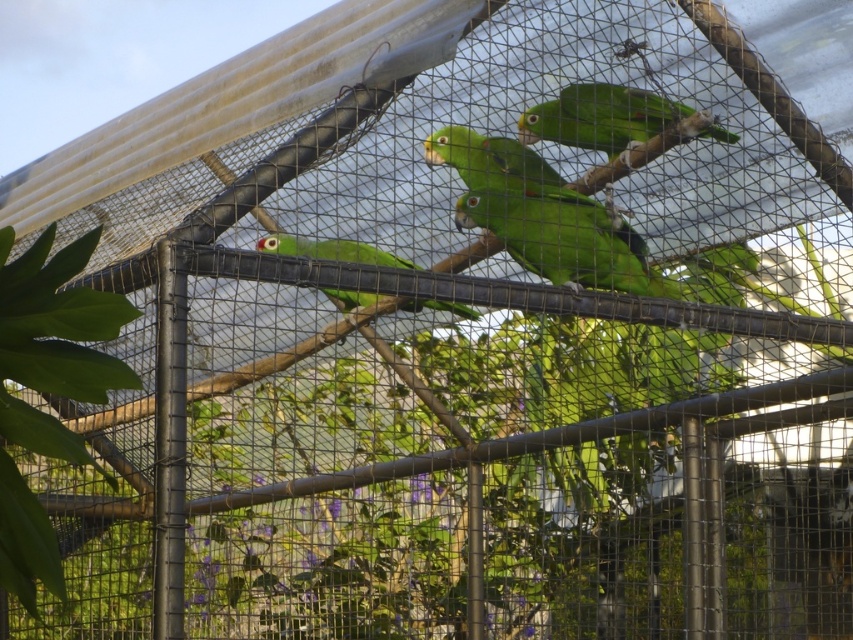
You are a bird keeper who needs to place a 12 inch long feeding tray between the green matte parrot at upper center and the green matte parrot at center. Can the feeding tray fit between them?

The green matte parrot at upper center and green matte parrot at center are 14.44 inches apart from each other. Since the feeding tray is 12 inches long, it can fit between them with some space remaining.

You are a birdwatcher observing the green matte parrot at upper center and the green matte parrot at center in the aviary. Which parrot has a smaller body width?

The green matte parrot at upper center has a smaller body width than the green matte parrot at center.

You are a visitor standing in front of the bird enclosure. You see two green matte parrots. Which one is closer to you, the green matte parrot at upper center or the green matte parrot at center?

The green matte parrot at upper center is closer to you because it is further to the viewer than the green matte parrot at center.